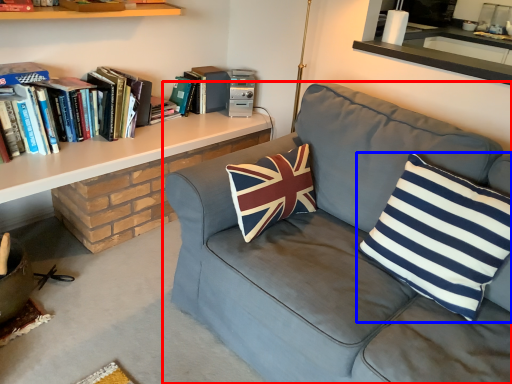
Question: Among these objects, which one is nearest to the camera, studio couch (highlighted by a red box) or pillow (highlighted by a blue box)?

Choices:
 (A) studio couch
 (B) pillow

Answer: (A)